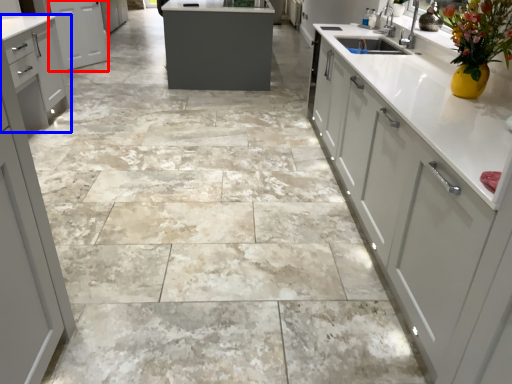
Question: Among these objects, which one is farthest to the camera, cabinetry (highlighted by a red box) or cabinetry (highlighted by a blue box)?

Choices:
 (A) cabinetry
 (B) cabinetry

Answer: (A)